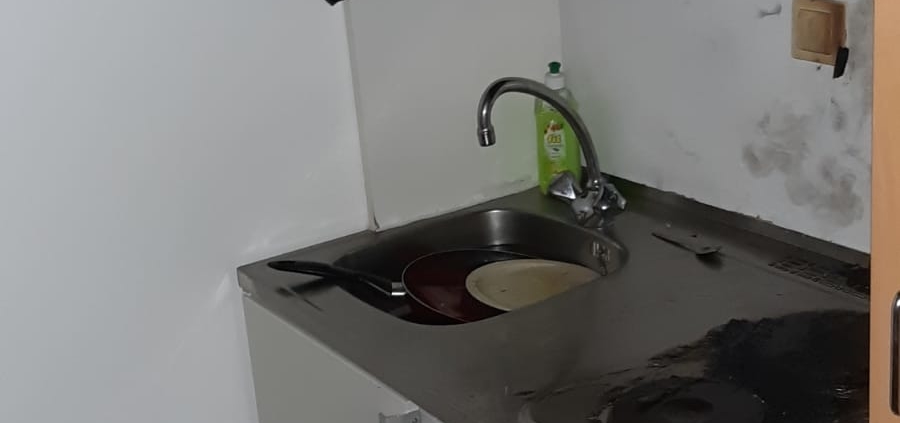
Find the location of a particular element. This screenshot has width=900, height=423. cabinet is located at coordinates (400, 412).